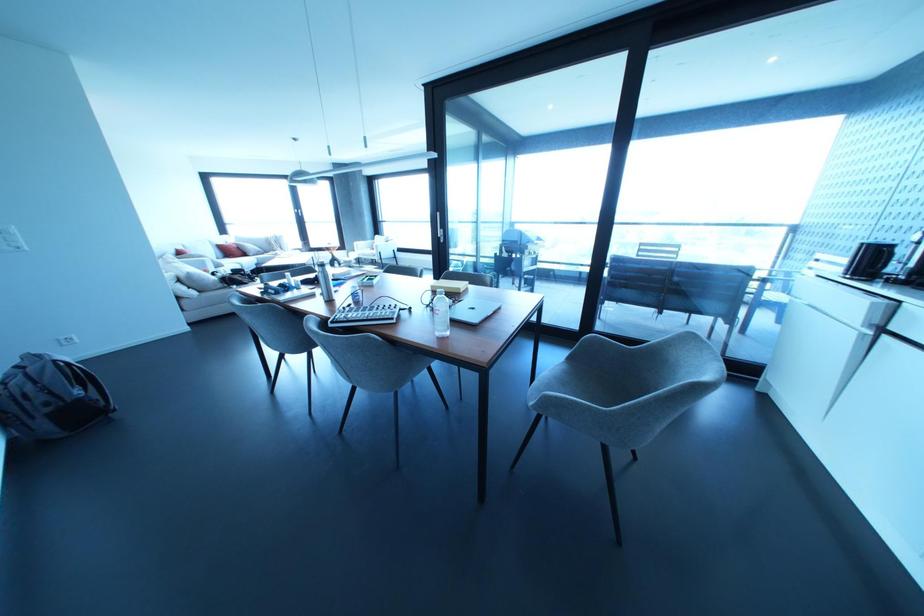
Describe the element at coordinates (886, 257) in the screenshot. I see `the black kettle handle` at that location.